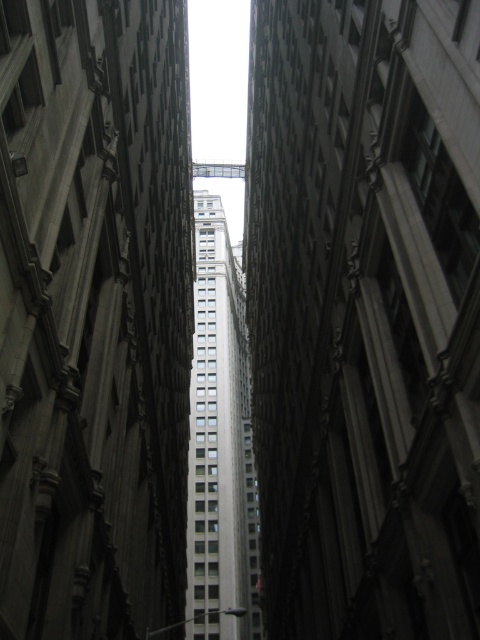
You are a drone operator trying to navigate through the narrow alleyway. You need to fly your drone between the smooth concrete building at center and the gray concrete skyscraper at center. Based on their positions, which building should you fly the drone closer to in order to avoid collision?

The gray concrete skyscraper at center is behind the smooth concrete building at center, so you should fly the drone closer to the smooth concrete building at center to avoid collision with the skyscraper which is further back.

You are standing in the narrow urban alleyway and want to reach the point marked at coordinates (456, 168). Given that the alleyway is only 2 meters wide, can you navigate to that point without moving sideways?

The point marked at coordinates (456, 168) is 29.88 meters away from the viewer. Since the alleyway is narrow but the distance is along the length, you can move forward to reach it without needing to move sideways.

You are a window cleaner who needs to reach the top of both the smooth concrete building at center and the gray concrete skyscraper at center. Which building will require you to climb higher?

The smooth concrete building at center is taller than the gray concrete skyscraper at center, so you will need to climb higher to reach the top of the smooth concrete building at center.